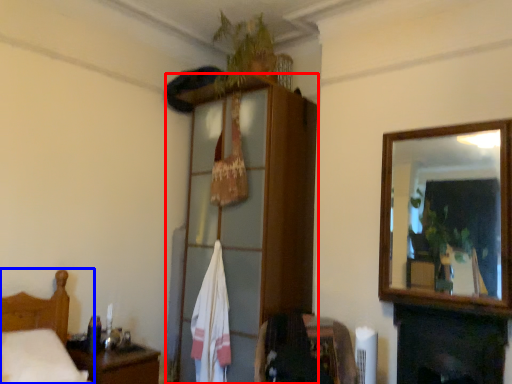
Question: Among these objects, which one is farthest to the camera, dresser (highlighted by a red box) or furniture (highlighted by a blue box)?

Choices:
 (A) dresser
 (B) furniture

Answer: (A)